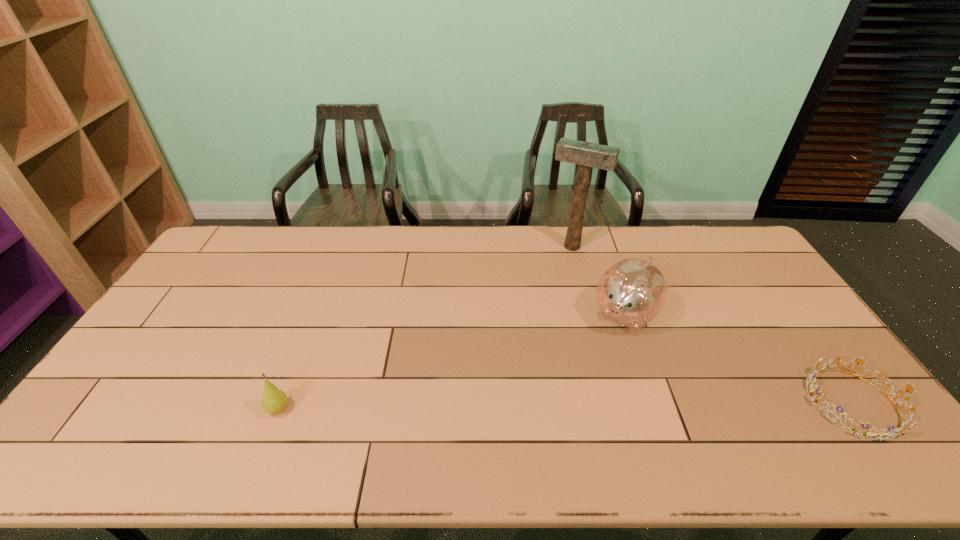
The image size is (960, 540). I want to click on free space located 0.360m on the front facing side of the piggy bank, so click(545, 421).

You are a GUI agent. You are given a task and a screenshot of the screen. Output one action in this format:
    pyautogui.click(x=<x>, y=<y>)
    Task: Click on the vacant space located on the front facing side of the piggy bank
    This screenshot has height=540, width=960.
    Given the screenshot: What is the action you would take?
    point(565,394)

Where is `vacant space located on the striking surface of the farthest object`? Image resolution: width=960 pixels, height=540 pixels. vacant space located on the striking surface of the farthest object is located at coordinates (536, 308).

At what (x,y) coordinates should I click in order to perform the action: click on vacant region located on the striking surface of the farthest object. Please return your answer as a coordinate pair (x, y). This screenshot has width=960, height=540. Looking at the image, I should click on (557, 267).

Find the location of `free space located on the striking surface of the farthest object`. free space located on the striking surface of the farthest object is located at coordinates coord(553,274).

Where is `object that is at the far edge`? The image size is (960, 540). object that is at the far edge is located at coordinates (587, 155).

At what (x,y) coordinates should I click in order to perform the action: click on pear that is at the near edge. Please return your answer as a coordinate pair (x, y). The height and width of the screenshot is (540, 960). Looking at the image, I should click on coord(274,401).

Where is `tiara at the near edge`? The image size is (960, 540). tiara at the near edge is located at coordinates (908, 416).

Locate an element on the screen. The image size is (960, 540). object present at the right edge is located at coordinates (908, 416).

This screenshot has width=960, height=540. I want to click on object at the near right corner, so click(908, 416).